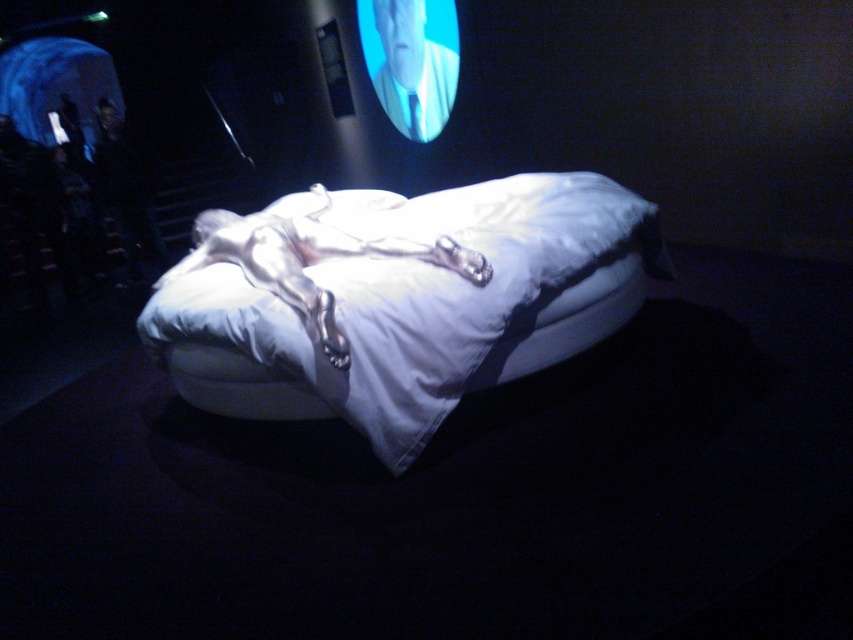
Question: Which point appears farthest from the camera in this image?

Choices:
 (A) (206, 246)
 (B) (589, 216)

Answer: (A)

Question: Among these objects, which one is farthest from the camera?

Choices:
 (A) white fabric bed at center
 (B) silver metallic sleeping bag at center

Answer: (A)

Question: Does white fabric bed at center have a lesser width compared to silver metallic sleeping bag at center?

Choices:
 (A) yes
 (B) no

Answer: (B)

Question: Is white fabric bed at center further to camera compared to silver metallic sleeping bag at center?

Choices:
 (A) yes
 (B) no

Answer: (A)

Question: Among these objects, which one is nearest to the camera?

Choices:
 (A) silver metallic sleeping bag at center
 (B) white fabric bed at center

Answer: (A)

Question: Can you confirm if white fabric bed at center is thinner than silver metallic sleeping bag at center?

Choices:
 (A) no
 (B) yes

Answer: (A)